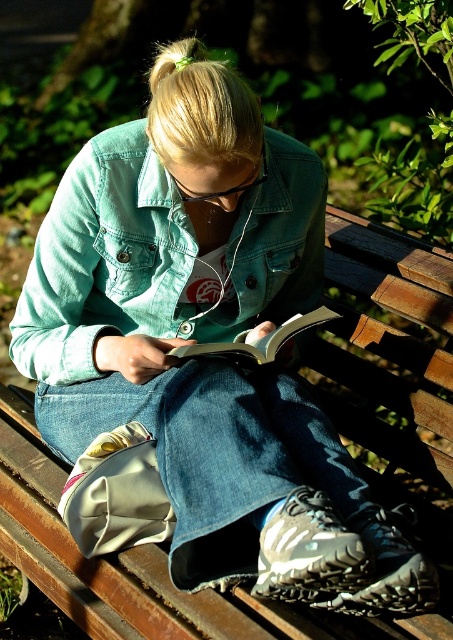
Question: Does denim jacket at center appear on the left side of hardcover book at center?

Choices:
 (A) yes
 (B) no

Answer: (A)

Question: Which point is farther from the camera taking this photo?

Choices:
 (A) (183, 227)
 (B) (182, 358)

Answer: (A)

Question: Is denim jacket at center smaller than hardcover book at center?

Choices:
 (A) no
 (B) yes

Answer: (A)

Question: Which point is closer to the camera?

Choices:
 (A) hardcover book at center
 (B) denim jacket at center

Answer: (B)

Question: Is denim jacket at center to the right of hardcover book at center from the viewer's perspective?

Choices:
 (A) no
 (B) yes

Answer: (A)

Question: Which object is farther from the camera taking this photo?

Choices:
 (A) denim jacket at center
 (B) hardcover book at center

Answer: (B)